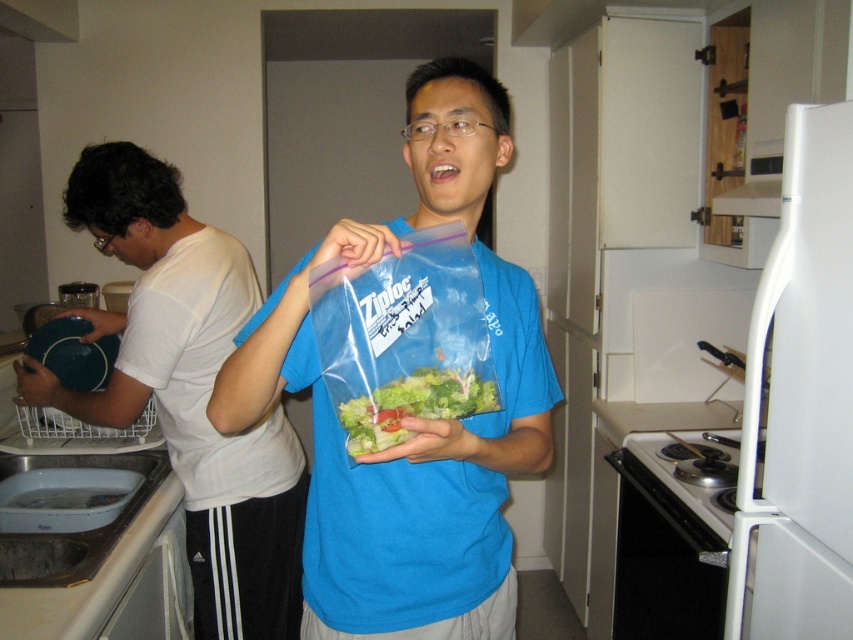
Who is more distant from viewer, (254, 634) or (425, 369)?

Point (254, 634)

I want to click on white matte shirt at left, so click(189, 388).

Does transparent plastic bag of salad at center appear on the right side of white matte shirt at left?

Indeed, transparent plastic bag of salad at center is positioned on the right side of white matte shirt at left.

Is transparent plastic bag of salad at center thinner than white matte shirt at left?

Yes, transparent plastic bag of salad at center is thinner than white matte shirt at left.

Is point (404, 570) farther from viewer compared to point (206, 618)?

No, (404, 570) is in front of (206, 618).

This screenshot has height=640, width=853. What are the coordinates of `transparent plastic bag of salad at center` in the screenshot? It's located at (409, 417).

Which is in front, point (416, 163) or point (376, 449)?

Point (376, 449)

Can you confirm if transparent plastic bag of salad at center is taller than translucent plastic salad at center?

Indeed, transparent plastic bag of salad at center has a greater height compared to translucent plastic salad at center.

Does point (489, 280) come behind point (378, 449)?

Yes, it is behind point (378, 449).

Locate an element on the screen. The width and height of the screenshot is (853, 640). transparent plastic bag of salad at center is located at coordinates pos(409,417).